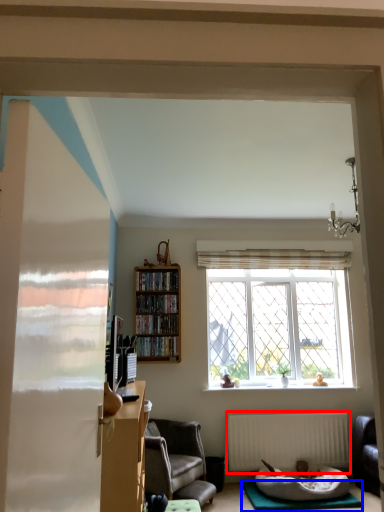
Question: Which object is closer to the camera taking this photo, radiator (highlighted by a red box) or yoga mat (highlighted by a blue box)?

Choices:
 (A) radiator
 (B) yoga mat

Answer: (B)